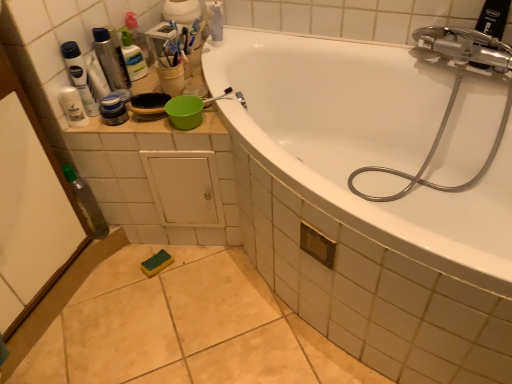
Question: From a real-world perspective, is silver metallic hose at upper right over white glossy mouthwash at upper left?

Choices:
 (A) no
 (B) yes

Answer: (A)

Question: Is silver metallic hose at upper right bigger than white glossy mouthwash at upper left?

Choices:
 (A) yes
 (B) no

Answer: (A)

Question: Would you say silver metallic hose at upper right contains white glossy mouthwash at upper left?

Choices:
 (A) no
 (B) yes

Answer: (A)

Question: From the image's perspective, is silver metallic hose at upper right on white glossy mouthwash at upper left?

Choices:
 (A) no
 (B) yes

Answer: (A)

Question: Considering the relative positions of silver metallic hose at upper right and white glossy mouthwash at upper left in the image provided, is silver metallic hose at upper right to the left of white glossy mouthwash at upper left from the viewer's perspective?

Choices:
 (A) yes
 (B) no

Answer: (B)

Question: Is white glossy bathtub at upper center taller or shorter than silver metallic hose at upper right?

Choices:
 (A) tall
 (B) short

Answer: (A)

Question: Choose the correct answer: Is white glossy bathtub at upper center inside silver metallic hose at upper right or outside it?

Choices:
 (A) outside
 (B) inside

Answer: (A)

Question: Considering the relative positions of white glossy bathtub at upper center and silver metallic hose at upper right in the image provided, is white glossy bathtub at upper center to the left or to the right of silver metallic hose at upper right?

Choices:
 (A) right
 (B) left

Answer: (B)

Question: From a real-world perspective, is white glossy bathtub at upper center above or below silver metallic hose at upper right?

Choices:
 (A) above
 (B) below

Answer: (B)

Question: From their relative heights in the image, would you say white glossy mouthwash at upper left is taller or shorter than transparent plastic screen door at left?

Choices:
 (A) short
 (B) tall

Answer: (A)

Question: From a real-world perspective, is white glossy mouthwash at upper left physically located above or below transparent plastic screen door at left?

Choices:
 (A) above
 (B) below

Answer: (A)

Question: Considering the positions of white glossy mouthwash at upper left and transparent plastic screen door at left in the image, is white glossy mouthwash at upper left bigger or smaller than transparent plastic screen door at left?

Choices:
 (A) big
 (B) small

Answer: (B)

Question: Relative to transparent plastic screen door at left, is white glossy mouthwash at upper left in front or behind?

Choices:
 (A) behind
 (B) front

Answer: (A)

Question: Considering the relative positions of matte black jar at upper left, which is the first toiletry in bottom-to-top order, and transparent plastic screen door at left in the image provided, is matte black jar at upper left, which is the first toiletry in bottom-to-top order, to the left or to the right of transparent plastic screen door at left?

Choices:
 (A) right
 (B) left

Answer: (A)

Question: Is point (124, 112) positioned closer to the camera than point (12, 281)?

Choices:
 (A) farther
 (B) closer

Answer: (A)